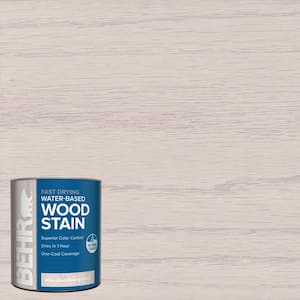
I want to click on grey wooden suface, so click(195, 155).